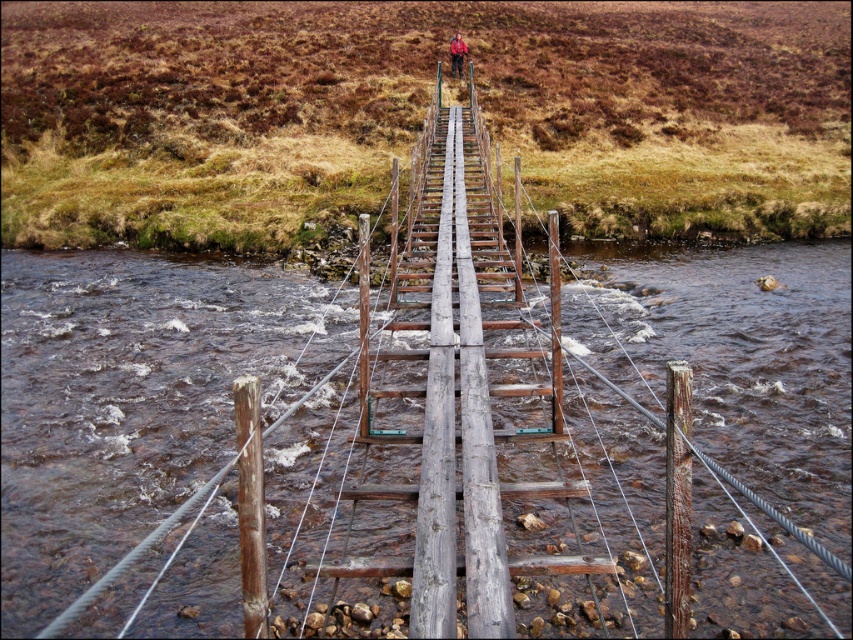
You are standing on the suspension bridge and want to know how far the point at coordinate [753,371] is from you. Can you determine the distance?

The point at coordinate [753,371] is 41.86 feet away from you.

You are standing on the brown wooden bridge at center and want to reach the point marked at coordinate point (131, 397). Is this point located on the bridge?

Yes, the point marked at coordinate point (131, 397) is on the brown wooden bridge at center, so you can reach it by walking along the bridge.

You are standing on the brown wooden bridge at center and want to reach the red matte jacket at center. Which direction should you move to get closer to the jacket?

The brown wooden bridge at center is positioned on the left side of the red matte jacket at center, so you should move to the right to get closer to the jacket.